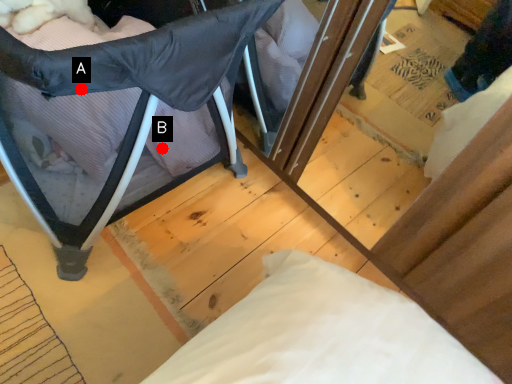
Question: Two points are circled on the image, labeled by A and B beside each circle. Which point is closer to the camera taking this photo?

Choices:
 (A) A is closer
 (B) B is closer

Answer: (A)